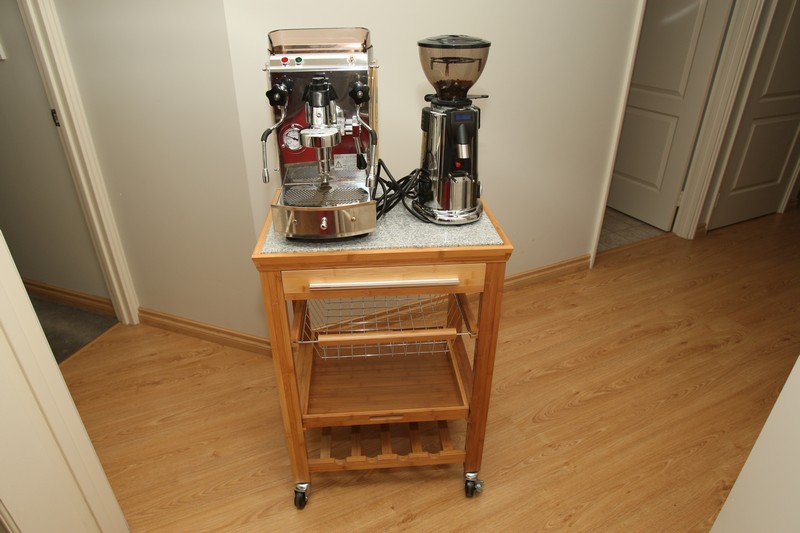
I want to click on left side of expresso machine, so click(345, 193).